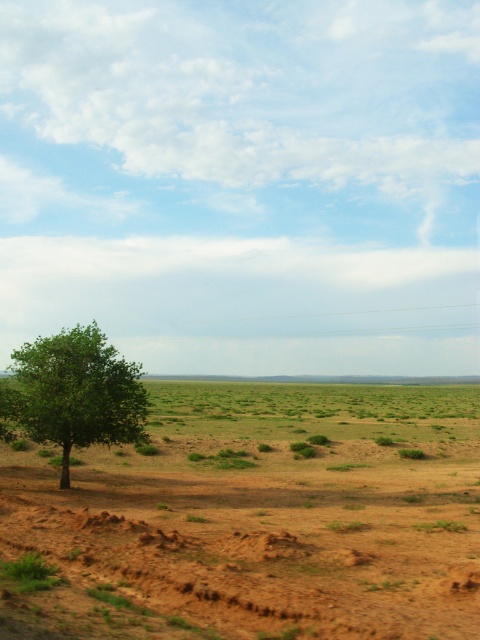
Question: Which object is farther from the camera taking this photo?

Choices:
 (A) green leafy tree at left
 (B) brown sandy dirt field at lower left

Answer: (A)

Question: Can you confirm if brown sandy dirt field at lower left is positioned to the left of green leafy tree at left?

Choices:
 (A) no
 (B) yes

Answer: (A)

Question: Can you confirm if brown sandy dirt field at lower left is positioned below green leafy tree at left?

Choices:
 (A) yes
 (B) no

Answer: (A)

Question: Can you confirm if brown sandy dirt field at lower left is bigger than green leafy tree at left?

Choices:
 (A) yes
 (B) no

Answer: (A)